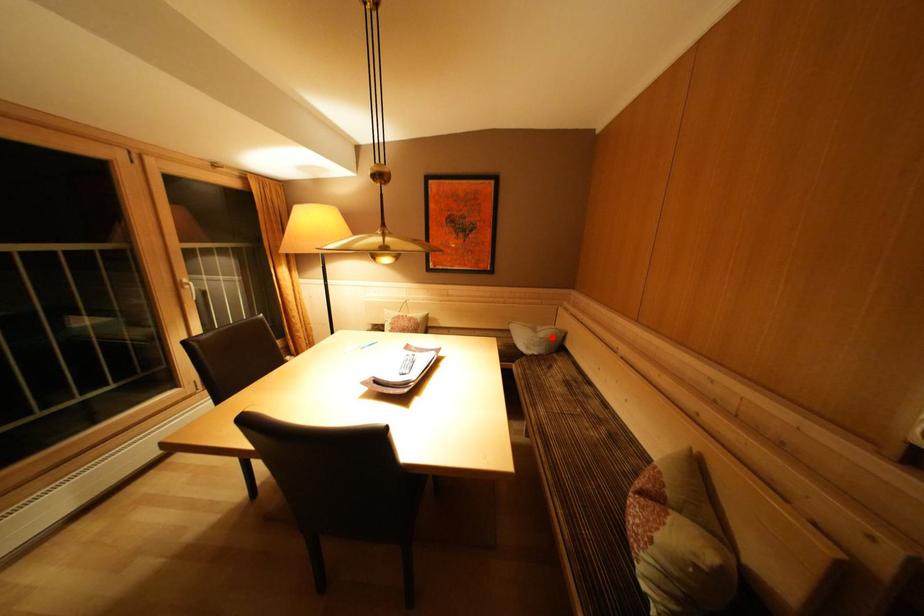
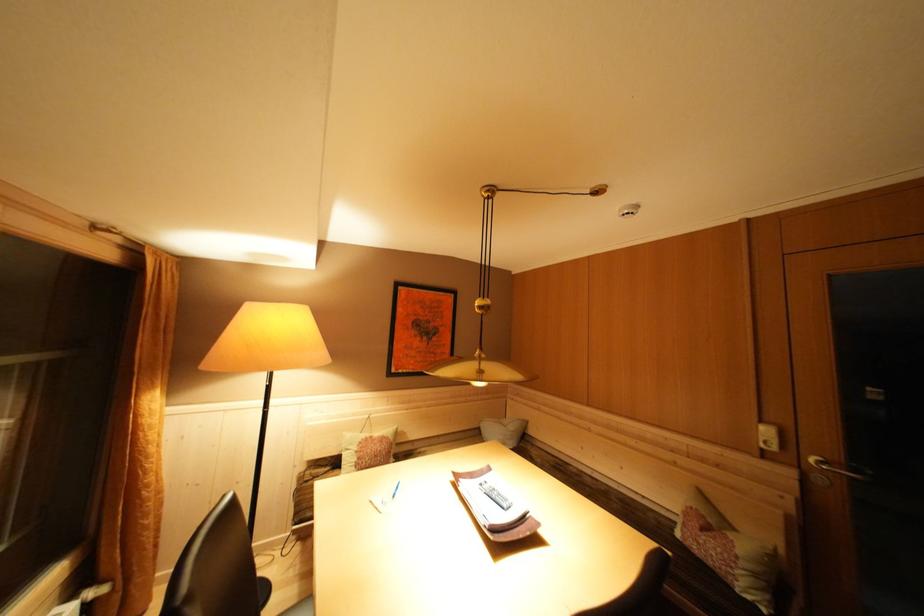
Locate, in the second image, the point that corresponds to the highlighted location in the first image.

(518, 430)